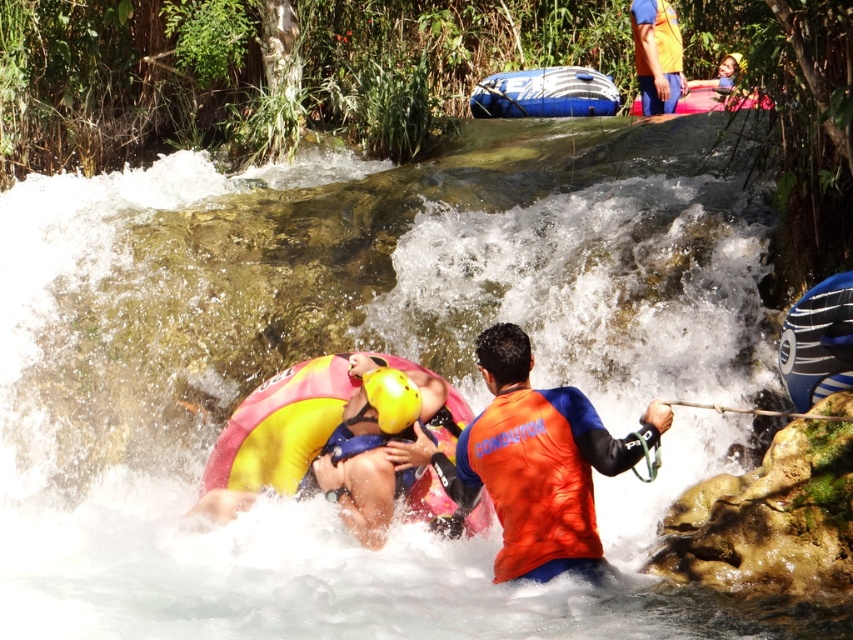
You are a safety officer assessing the scene. The point at coordinates (444, 444) is where the guide needs to reach the person in the water. Can the guide safely reach that point without entering the water? The guide is 6 feet tall.

The distance of point (444, 444) from viewer is 26.65 feet. Since the guide is 6 feet tall, they can safely reach the point without entering the water as the distance is manageable for them to extend their arms and provide assistance from their current position.